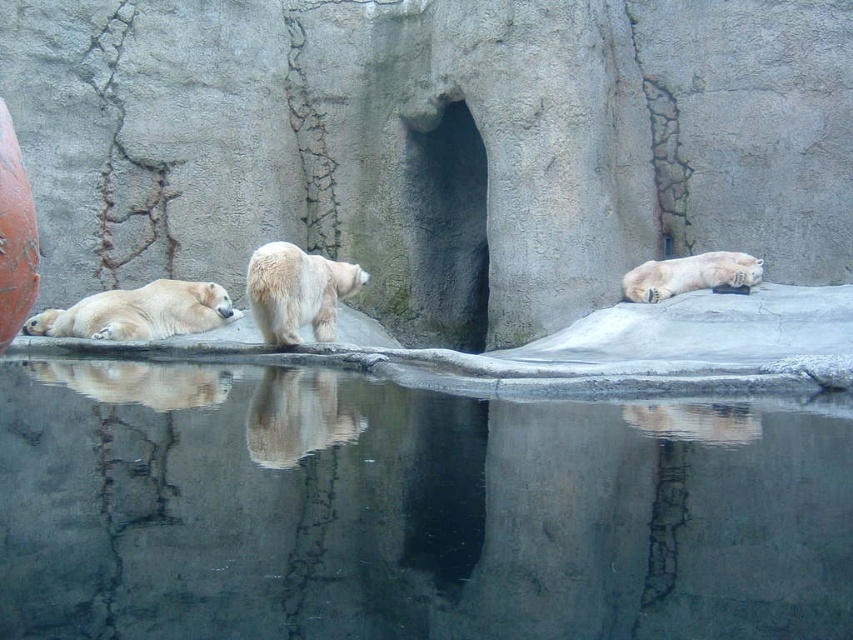
Question: From the image, what is the correct spatial relationship of white fur bear at left in relation to white fur bear at upper right?

Choices:
 (A) below
 (B) above

Answer: (A)

Question: Is white fur bear at left to the left of white fluffy bear at center from the viewer's perspective?

Choices:
 (A) yes
 (B) no

Answer: (A)

Question: Is white fur bear at left positioned in front of white fur bear at upper right?

Choices:
 (A) yes
 (B) no

Answer: (A)

Question: Among these objects, which one is nearest to the camera?

Choices:
 (A) white fur bear at upper right
 (B) transparent glass water at center

Answer: (B)

Question: Which of the following is the closest to the observer?

Choices:
 (A) (669, 508)
 (B) (337, 273)
 (C) (727, 273)

Answer: (A)

Question: Which of the following is the farthest from the observer?

Choices:
 (A) transparent glass water at center
 (B) white fluffy bear at center
 (C) white fur polar bear at center
 (D) white fur boulder at center

Answer: (D)